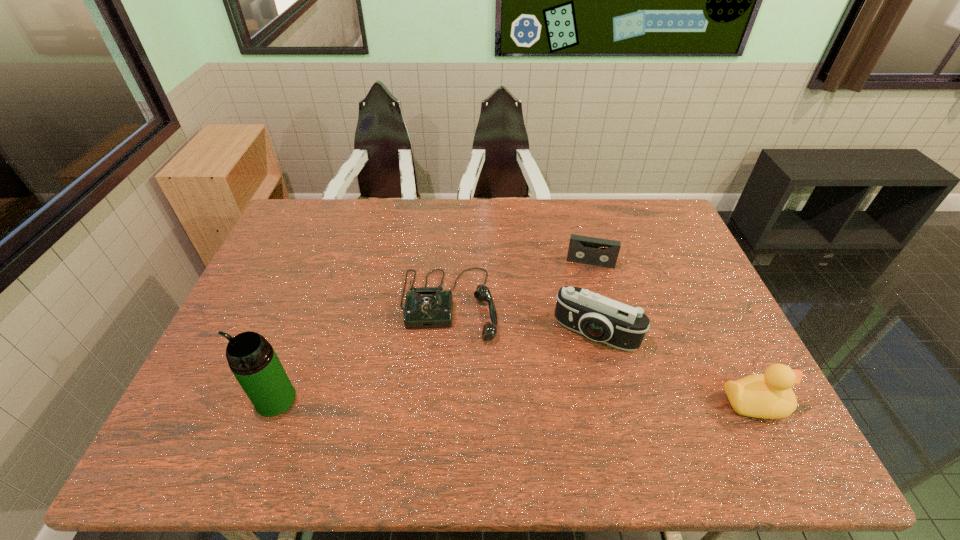
Identify the location of free spot on the desktop that is between the leftmost object and the rightmost object and is positioned on the dial of the second object from left to right. (448, 401).

Where is `free space on the desktop that is between the thermos bottle and the duck and is positioned on the front-facing side of the farthest object`? free space on the desktop that is between the thermos bottle and the duck and is positioned on the front-facing side of the farthest object is located at coordinates (577, 402).

At what (x,y) coordinates should I click in order to perform the action: click on vacant space on the desktop that is between the thermos bottle and the rightmost object and is positioned on the front lens of the camera. Please return your answer as a coordinate pair (x, y). Looking at the image, I should click on pos(563,401).